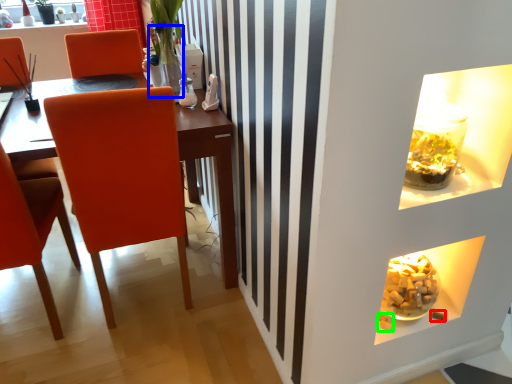
Question: Based on their relative distances, which object is farther from food (highlighted by a red box)? Choose from glass vase (highlighted by a blue box) and food (highlighted by a green box).

Choices:
 (A) glass vase
 (B) food

Answer: (A)